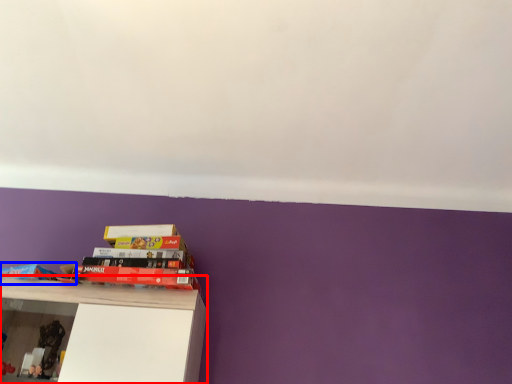
Question: Which of the following is the farthest to the observer, shelf (highlighted by a red box) or book (highlighted by a blue box)?

Choices:
 (A) shelf
 (B) book

Answer: (B)